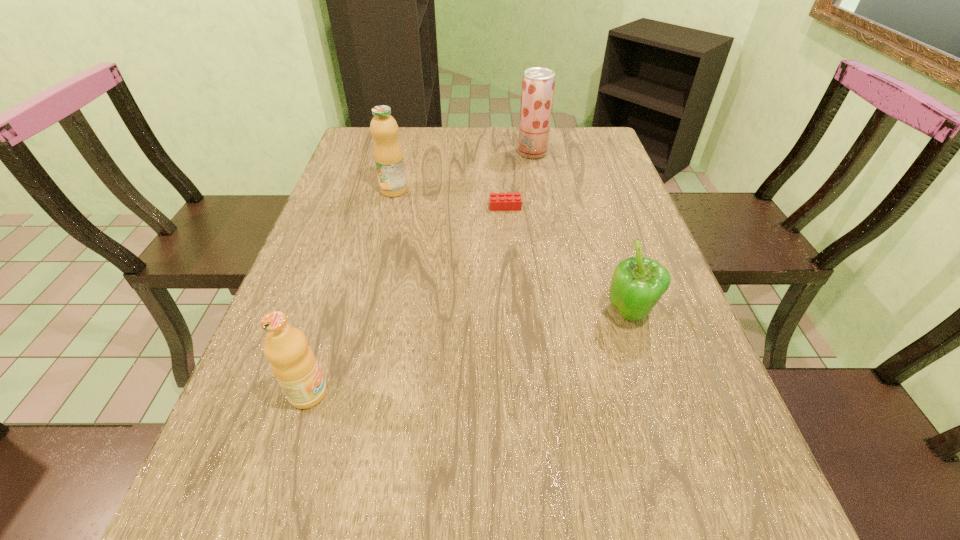
The image size is (960, 540). Identify the location of object that is the closest one to the fourth nearest object. (501, 201).

Where is `the closest object relative to the nearest fruit juice`? the closest object relative to the nearest fruit juice is located at coordinates (637, 284).

Locate which fruit juice is the closest to the shortest fruit juice. Please provide its 2D coordinates. Your answer should be formatted as a tuple, i.e. [(x, y)], where the tuple contains the x and y coordinates of a point satisfying the conditions above.

[(388, 156)]

I want to click on the second closest fruit juice relative to the Lego, so click(x=388, y=156).

Identify the location of blank area in the image that satisfies the following two spatial constraints: 1. on the back side of the rightmost fruit juice; 2. on the left side of the third object from right to left. The height and width of the screenshot is (540, 960). (501, 153).

What are the coordinates of `vacant region that satisfies the following two spatial constraints: 1. on the front label of the second farthest object; 2. on the right side of the bell pepper` in the screenshot? It's located at (362, 314).

Image resolution: width=960 pixels, height=540 pixels. I want to click on blank area in the image that satisfies the following two spatial constraints: 1. on the front label of the second farthest fruit juice; 2. on the front label of the shortest fruit juice, so click(342, 393).

Find the location of `free region that satisfies the following two spatial constraints: 1. on the front side of the rightmost fruit juice; 2. on the front label of the nearest object`. free region that satisfies the following two spatial constraints: 1. on the front side of the rightmost fruit juice; 2. on the front label of the nearest object is located at coordinates (574, 393).